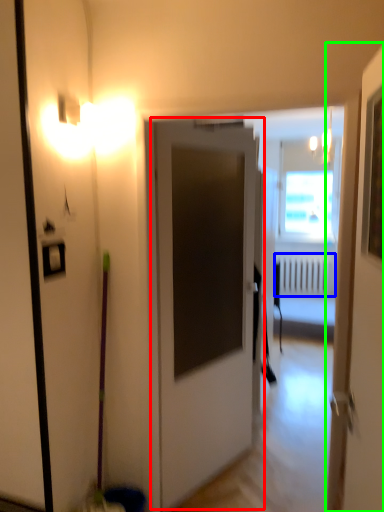
Question: Estimate the real-world distances between objects in this image. Which object is closer to door (highlighted by a red box), radiator (highlighted by a blue box) or door (highlighted by a green box)?

Choices:
 (A) radiator
 (B) door

Answer: (B)